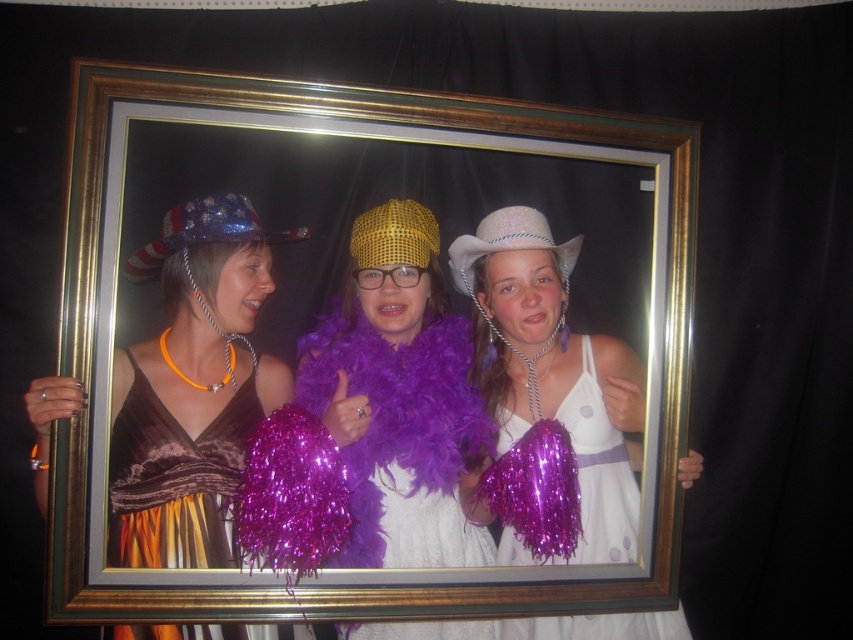
Question: Which of the following is the farthest from the observer?

Choices:
 (A) white matte dress at center
 (B) gold/metallic picture frame at center
 (C) shiny gold mesh hat at center

Answer: (C)

Question: Which point is closer to the camera?

Choices:
 (A) white textured hat at center
 (B) white matte dress at center
 (C) shiny metallic dress at left

Answer: (C)

Question: Which object is farther from the camera taking this photo?

Choices:
 (A) white textured hat at center
 (B) purple feather boa at center
 (C) sparkly metallic hat at left

Answer: (A)

Question: Can you confirm if sparkly metallic hat at left is wider than white textured hat at center?

Choices:
 (A) yes
 (B) no

Answer: (A)

Question: Considering the relative positions of white satin dress at center and sparkly metallic hat at left in the image provided, where is white satin dress at center located with respect to sparkly metallic hat at left?

Choices:
 (A) right
 (B) left

Answer: (A)

Question: Can you confirm if sparkly metallic hat at left is bigger than shiny gold mesh hat at center?

Choices:
 (A) no
 (B) yes

Answer: (B)